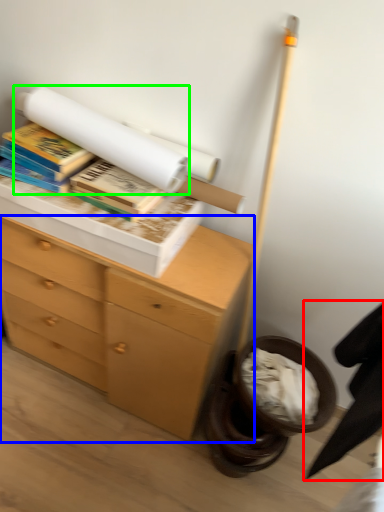
Question: Based on their relative distances, which object is farther from swivel chair (highlighted by a red box)? Choose from chest of drawers (highlighted by a blue box) and book (highlighted by a green box).

Choices:
 (A) chest of drawers
 (B) book

Answer: (B)